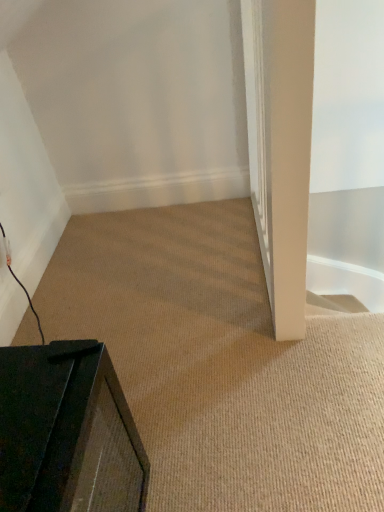
Find the location of a particular element. black matte tv at lower left is located at coordinates (222, 364).

Is point (216, 230) closer or farther from the camera than point (89, 452)?

Point (216, 230).

Is black matte tv at lower left looking in the opposite direction of black matte speaker at lower left?

black matte tv at lower left does not have its back to black matte speaker at lower left.

Consider the image. Is black matte tv at lower left not within black matte speaker at lower left?

Indeed, black matte tv at lower left is completely outside black matte speaker at lower left.

Is the depth of black matte tv at lower left greater than that of black matte speaker at lower left?

Yes, it is.

Measure the distance between white smooth pillar at right and black matte speaker at lower left.

They are 31.01 inches apart.

Consider the image. Which object is positioned more to the right, white smooth pillar at right or black matte speaker at lower left?

white smooth pillar at right.

Consider the image. Is black matte speaker at lower left a part of white smooth pillar at right?

Definitely not — black matte speaker at lower left is not inside white smooth pillar at right.

From the image's perspective, is white smooth pillar at right above black matte speaker at lower left?

Yes.

Locate an element on the screen. plain lying on the right of black matte speaker at lower left is located at coordinates (222, 364).

Between point (35, 371) and point (237, 269), which one is positioned behind?

The point (237, 269) is more distant.

How different are the orientations of black matte speaker at lower left and black matte tv at lower left in degrees?

The angle between the facing direction of black matte speaker at lower left and the facing direction of black matte tv at lower left is 89.8 degrees.

Which of these two, black matte speaker at lower left or black matte tv at lower left, is thinner?

With smaller width is black matte speaker at lower left.

From the image's perspective, is black matte speaker at lower left located above or below white smooth pillar at right?

From the image's perspective, black matte speaker at lower left appears below white smooth pillar at right.

Considering the positions of points (71, 480) and (286, 105), is point (71, 480) closer to camera compared to point (286, 105)?

No, (71, 480) is behind (286, 105).

Considering the positions of objects black matte speaker at lower left and white smooth pillar at right in the image provided, who is more to the left, black matte speaker at lower left or white smooth pillar at right?

black matte speaker at lower left.

Are black matte speaker at lower left and white smooth pillar at right beside each other?

No, black matte speaker at lower left is not in contact with white smooth pillar at right.

Which is more to the left, white smooth pillar at right or black matte tv at lower left?

From the viewer's perspective, black matte tv at lower left appears more on the left side.

In the scene shown: In the image, is white smooth pillar at right positioned in front of or behind black matte tv at lower left?

white smooth pillar at right is positioned closer to the viewer than black matte tv at lower left.

Is the surface of white smooth pillar at right in direct contact with black matte tv at lower left?

white smooth pillar at right and black matte tv at lower left are not in contact.

Is black matte tv at lower left at the back of white smooth pillar at right?

Absolutely, white smooth pillar at right is directed away from black matte tv at lower left.

Which of these two, black matte tv at lower left or white smooth pillar at right, stands shorter?

Standing shorter between the two is black matte tv at lower left.

Can you confirm if black matte tv at lower left is smaller than white smooth pillar at right?

Indeed, black matte tv at lower left has a smaller size compared to white smooth pillar at right.

From a real-world perspective, between black matte tv at lower left and white smooth pillar at right, who is vertically lower?

black matte tv at lower left.

In the image, there is a black matte speaker at lower left. Where is `plain below it (from a real-world perspective)`? This screenshot has width=384, height=512. plain below it (from a real-world perspective) is located at coordinates (222, 364).

Find the location of `furniture lying in front of the white smooth pillar at right`. furniture lying in front of the white smooth pillar at right is located at coordinates (67, 432).

From the image, which object appears to be nearer to black matte tv at lower left, black matte speaker at lower left or white smooth pillar at right?

black matte speaker at lower left is positioned closer to the anchor black matte tv at lower left.

Based on their spatial positions, is white smooth pillar at right or black matte tv at lower left further from black matte speaker at lower left?

The object further to black matte speaker at lower left is white smooth pillar at right.

Based on their spatial positions, is black matte tv at lower left or black matte speaker at lower left closer to white smooth pillar at right?

Based on the image, black matte tv at lower left appears to be nearer to white smooth pillar at right.

From the image, which object appears to be farther from black matte speaker at lower left, black matte tv at lower left or white smooth pillar at right?

Among the two, white smooth pillar at right is located further to black matte speaker at lower left.

Considering their positions, is black matte speaker at lower left positioned closer to white smooth pillar at right than black matte tv at lower left?

black matte tv at lower left.

From the image, which object appears to be nearer to black matte tv at lower left, white smooth pillar at right or black matte speaker at lower left?

black matte speaker at lower left is positioned closer to the anchor black matte tv at lower left.

At what (x,y) coordinates should I click in order to perform the action: click on plain between white smooth pillar at right and black matte speaker at lower left in the vertical direction. Please return your answer as a coordinate pair (x, y). Looking at the image, I should click on (222, 364).